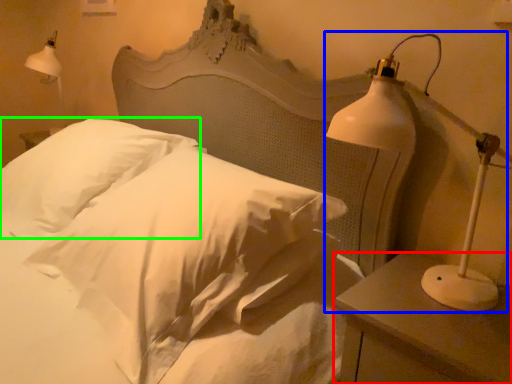
Question: Considering the real-world distances, which object is closest to nightstand (highlighted by a red box)? lamp (highlighted by a blue box) or pillow (highlighted by a green box).

Choices:
 (A) lamp
 (B) pillow

Answer: (A)